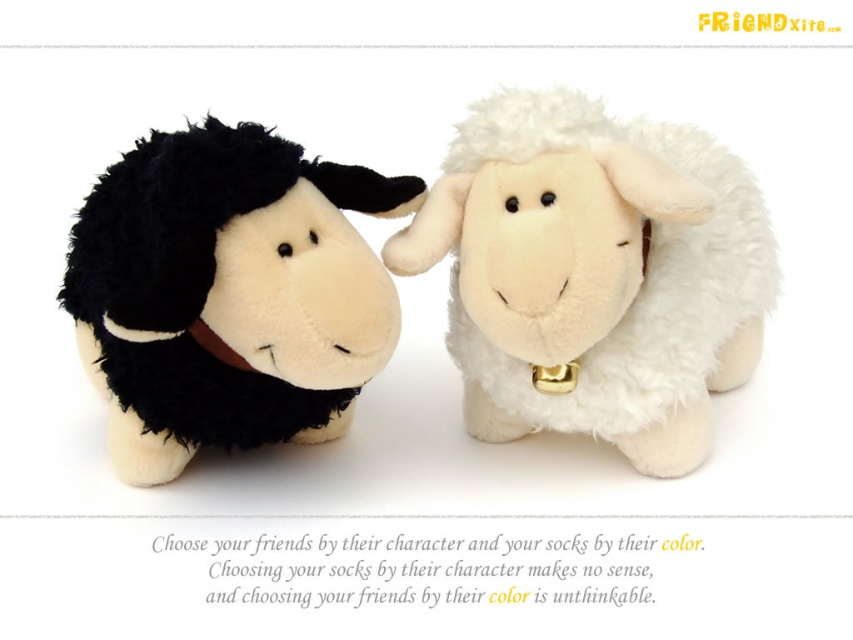
Question: Considering the real-world distances, which object is farthest from the brown fabric neckband at left?

Choices:
 (A) black plush sheep at left
 (B) white plush sheep at center

Answer: (B)

Question: Is black plush sheep at left to the left of brown fabric neckband at left from the viewer's perspective?

Choices:
 (A) no
 (B) yes

Answer: (B)

Question: Does white plush sheep at center have a larger size compared to brown fabric neckband at left?

Choices:
 (A) no
 (B) yes

Answer: (B)

Question: Estimate the real-world distances between objects in this image. Which object is farther from the brown fabric neckband at left?

Choices:
 (A) white plush sheep at center
 (B) black plush sheep at left

Answer: (A)

Question: Does black plush sheep at left have a greater width compared to brown fabric neckband at left?

Choices:
 (A) no
 (B) yes

Answer: (B)

Question: Which point is closer to the camera?

Choices:
 (A) (251, 371)
 (B) (187, 326)
 (C) (459, 323)

Answer: (B)